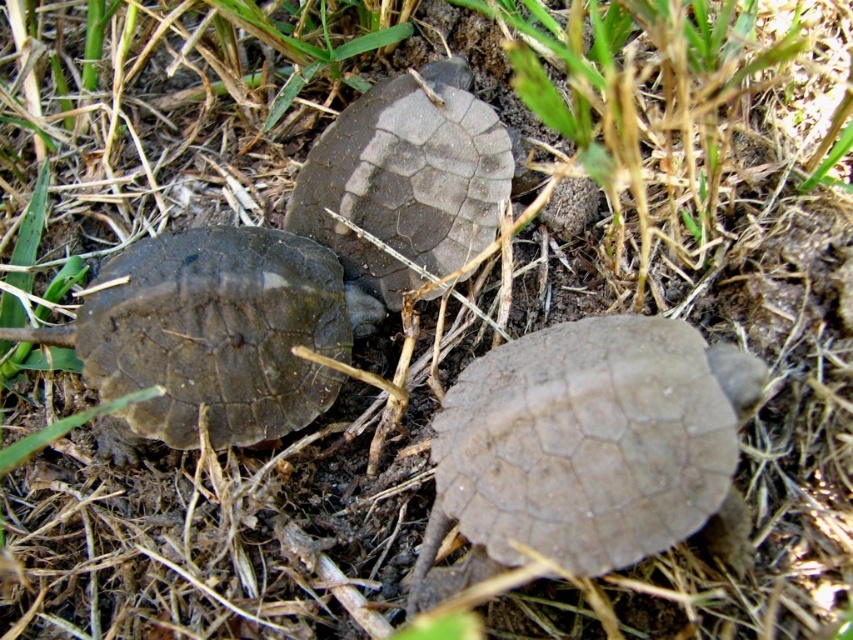
Question: Which point appears closest to the camera in this image?

Choices:
 (A) (123, 301)
 (B) (608, 547)
 (C) (361, 316)

Answer: (B)

Question: Can you confirm if brown matte tortoise at lower right is positioned below matte brown tortoise shell at center?

Choices:
 (A) no
 (B) yes

Answer: (B)

Question: Where is brown matte tortoise at lower right located in relation to matte brown tortoise at left in the image?

Choices:
 (A) below
 (B) above

Answer: (A)

Question: Which of the following is the closest to the observer?

Choices:
 (A) matte brown tortoise shell at center
 (B) matte brown tortoise at left
 (C) brown matte tortoise at lower right

Answer: (C)

Question: Which object is farther from the camera taking this photo?

Choices:
 (A) brown matte tortoise at lower right
 (B) matte brown tortoise shell at center

Answer: (B)

Question: Does matte brown tortoise shell at center appear on the left side of matte brown tortoise at left?

Choices:
 (A) no
 (B) yes

Answer: (A)